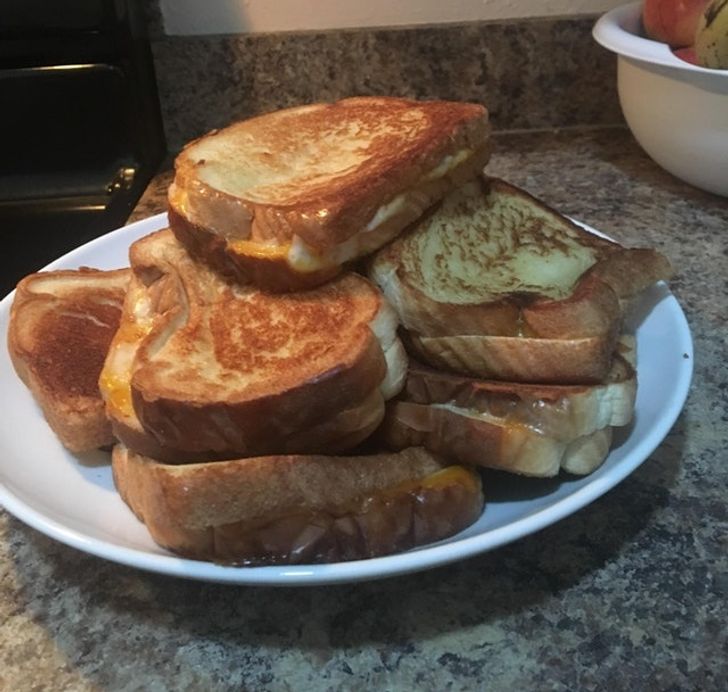
You are a GUI agent. You are given a task and a screenshot of the screen. Output one action in this format:
    pyautogui.click(x=<x>, y=<y>)
    Task: Click on the bowl
    
    Given the screenshot: What is the action you would take?
    pyautogui.click(x=684, y=136)